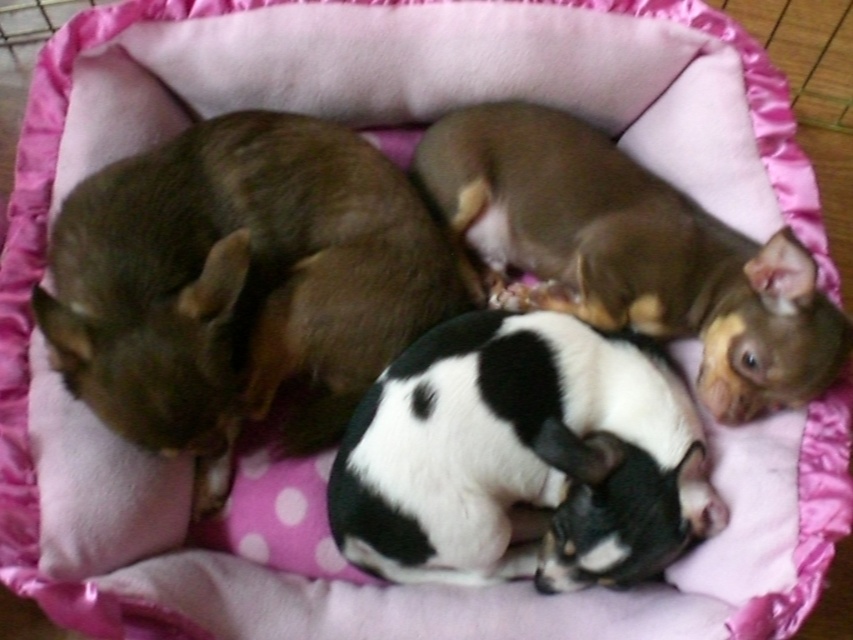
You are a photographer wanting to capture a closeup of the black and white fur at center without including the brown fur dog at left in the frame. Based on their positions, is it possible to do this?

The brown fur dog at left is positioned on the left side of black and white fur at center, so it is possible to frame the shot to exclude the brown fur dog at left by focusing on the right side of the black and white fur at center.

You are a photographer trying to capture a closeup of the black puppy with white markings in the pink pet bed. You have two markers labeled point A at point (573, 504) and point B at point (693, 308). Which point should you focus on to ensure the black puppy with white markings is in the foreground of your photo?

You should focus on point A at point (573, 504) because it is closer to the viewer than point B at point (693, 308), ensuring the black puppy with white markings is in the foreground.

You are a photographer trying to capture a closeup of the brown fur dog at left. The camera is currently focused on point (x=239, y=284). Is the camera focused on the correct spot?

Yes, the camera is focused on the correct spot because point (x=239, y=284) indicates the brown fur dog at left.